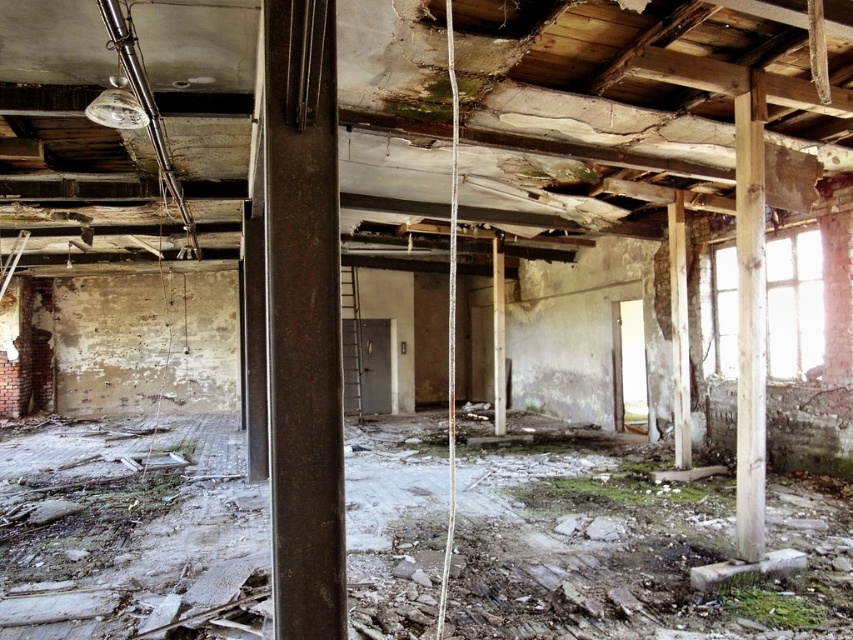
Question: Which point appears closest to the camera in this image?

Choices:
 (A) (735, 228)
 (B) (293, 401)
 (C) (669, 289)

Answer: (B)

Question: Among these points, which one is farthest from the camera?

Choices:
 (A) (679, 292)
 (B) (503, 390)
 (C) (294, 156)

Answer: (B)

Question: Can you confirm if rusty metal beam at center is smaller than smooth concrete pillar at center?

Choices:
 (A) no
 (B) yes

Answer: (A)

Question: Can you confirm if rusty metal beam at center is positioned below wooden post at right?

Choices:
 (A) no
 (B) yes

Answer: (B)

Question: Among these objects, which one is farthest from the camera?

Choices:
 (A) wooden post at right
 (B) smooth concrete pillar at center
 (C) wooden beam at center

Answer: (C)

Question: Is wooden post at right wider than smooth concrete pillar at center?

Choices:
 (A) yes
 (B) no

Answer: (A)